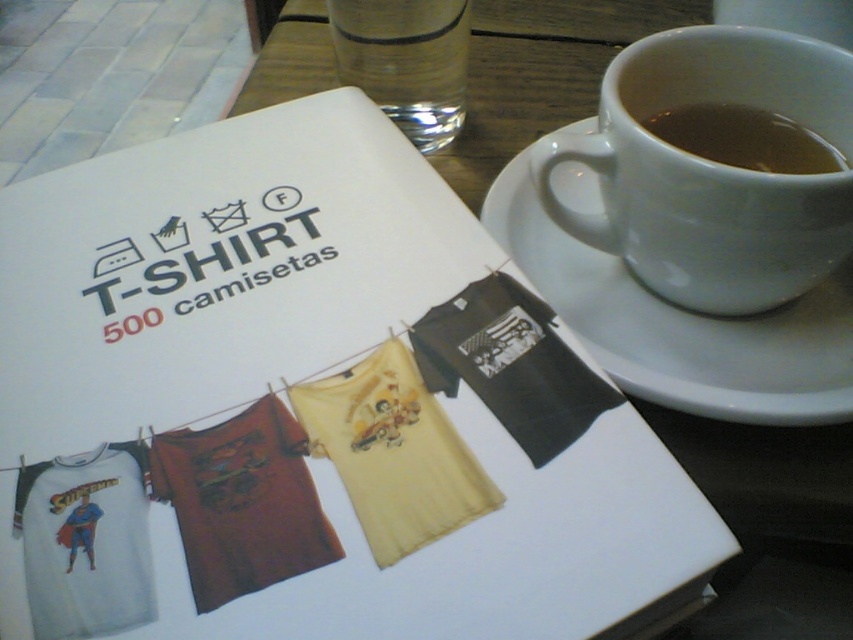
You are looking at the table setting and want to pick up the item closest to the camera. Which point should you reach for, point (564,253) or point (426,64)?

You should reach for point (564,253) because it is closer to the camera than point (426,64).

You are arranging items on a table and need to place a small vase between the white ceramic saucer at upper right and the clear glass water at upper center. Based on their positions, which item is closer to you so the vase can be placed appropriately?

The white ceramic saucer at upper right is closer to the viewer than the clear glass water at upper center, so you should place the vase between them starting from the white ceramic saucer at upper right side first.

You are at a cafe and see a table with a white ceramic mug at upper right and a brown liquid at upper right. Which item is positioned more to the right side of the table?

The brown liquid at upper right is more to the right because the white ceramic mug at upper right is to its left.